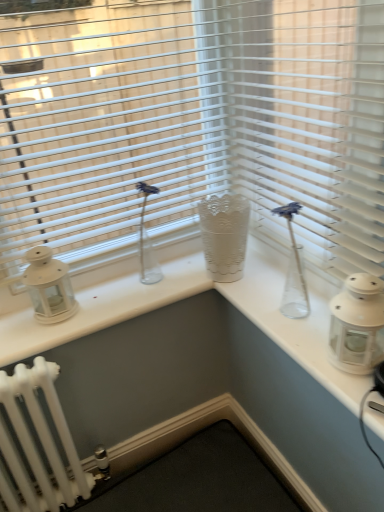
This screenshot has width=384, height=512. Describe the element at coordinates (299, 119) in the screenshot. I see `white plastic blinds at center` at that location.

Measure the distance between white glass lantern at right, which appears as the first candle holder when viewed from the right, and camera.

They are 31.14 inches apart.

The image size is (384, 512). I want to click on white plastic blinds at upper center, so click(x=193, y=126).

Between white plastic blinds at upper center and white glass lantern at right, the 2th candle holder viewed from the back, which one is positioned behind?

white plastic blinds at upper center is further from the camera.

Would you say white plastic blinds at upper center is outside white glass lantern at right, the 2th candle holder viewed from the back?

Yes, white plastic blinds at upper center is located beyond the bounds of white glass lantern at right, the 2th candle holder viewed from the back.

Relative to white plastic blinds at center, is white plastic blinds at upper center in front or behind?

white plastic blinds at upper center is behind white plastic blinds at center.

Is white plastic blinds at upper center aimed at white plastic blinds at center?

Yes.

Does white plastic blinds at upper center have a greater width compared to white plastic blinds at center?

Yes, white plastic blinds at upper center is wider than white plastic blinds at center.

Locate an element on the screen. The width and height of the screenshot is (384, 512). blind that appears in front of the white plastic blinds at upper center is located at coordinates (299, 119).

Is white plastic blinds at upper center surrounded by white glass lantern at right, which appears as the first candle holder when viewed from the right?

Definitely not — white plastic blinds at upper center is not inside white glass lantern at right, which appears as the first candle holder when viewed from the right.

Measure the distance between white glass lantern at right, which appears as the first candle holder when viewed from the right, and white plastic blinds at upper center.

white glass lantern at right, which appears as the first candle holder when viewed from the right, and white plastic blinds at upper center are 21.53 inches apart.

Visually, is white glass lantern at right, which appears as the first candle holder when viewed from the right, positioned to the left or to the right of white plastic blinds at upper center?

white glass lantern at right, which appears as the first candle holder when viewed from the right, is positioned on white plastic blinds at upper center's right side.

From a real-world perspective, is white glass lantern at right, the 2th candle holder in the left-to-right sequence, physically located above or below white plastic blinds at upper center?

white glass lantern at right, the 2th candle holder in the left-to-right sequence, is situated lower than white plastic blinds at upper center in the real world.

Looking at this image, can you confirm if white plastic blinds at center is bigger than white matte lantern at left, which is the first candle holder in back-to-front order?

Yes, white plastic blinds at center is bigger than white matte lantern at left, which is the first candle holder in back-to-front order.

From the image's perspective, is white plastic blinds at center positioned above or below white matte lantern at left, which is the second candle holder in right-to-left order?

Based on their image positions, white plastic blinds at center is located above white matte lantern at left, which is the second candle holder in right-to-left order.

Is white plastic blinds at center positioned far away from white matte lantern at left, positioned as the first candle holder in left-to-right order?

Actually, white plastic blinds at center and white matte lantern at left, positioned as the first candle holder in left-to-right order, are a little close together.

In the scene shown: Which point is more forward, (313, 103) or (49, 286)?

The point (313, 103) is closer to the camera.

Is white matte lantern at left, which is the second candle holder in right-to-left order, beside white plastic blinds at upper center?

Result: white matte lantern at left, which is the second candle holder in right-to-left order, and white plastic blinds at upper center are not in contact.

Identify the location of candle holder on the left of white plastic blinds at upper center. (49, 286).

Considering the sizes of objects white matte lantern at left, which is the second candle holder in right-to-left order, and white plastic blinds at upper center in the image provided, who is wider, white matte lantern at left, which is the second candle holder in right-to-left order, or white plastic blinds at upper center?

With larger width is white plastic blinds at upper center.

Can you confirm if white matte lantern at left, which is the first candle holder in back-to-front order, is bigger than white plastic blinds at upper center?

Actually, white matte lantern at left, which is the first candle holder in back-to-front order, might be smaller than white plastic blinds at upper center.

Which of these two, white glass lantern at right, the 2th candle holder viewed from the back, or white matte lantern at left, which is the second candle holder in right-to-left order, is wider?

With larger width is white glass lantern at right, the 2th candle holder viewed from the back.

Is there a large distance between white glass lantern at right, which appears as the first candle holder when viewed from the right, and white matte lantern at left, which is the first candle holder in back-to-front order?

No, there isn't a large distance between white glass lantern at right, which appears as the first candle holder when viewed from the right, and white matte lantern at left, which is the first candle holder in back-to-front order.

From a real-world perspective, is white glass lantern at right, the 2th candle holder in the left-to-right sequence, physically located above or below white matte lantern at left, placed as the 2th candle holder when sorted from front to back?

In terms of real-world spatial position, white glass lantern at right, the 2th candle holder in the left-to-right sequence, is above white matte lantern at left, placed as the 2th candle holder when sorted from front to back.

Is point (357, 287) closer or farther from the camera than point (66, 265)?

Point (357, 287).

Does white glass lantern at right, the 2th candle holder viewed from the back, appear on the left side of white plastic blinds at center?

Incorrect, white glass lantern at right, the 2th candle holder viewed from the back, is not on the left side of white plastic blinds at center.

Which point is more forward, (x=351, y=335) or (x=328, y=233)?

The point (x=351, y=335) is in front.

How far apart are white glass lantern at right, the 2th candle holder viewed from the back, and white plastic blinds at center?

white glass lantern at right, the 2th candle holder viewed from the back, is 41.08 centimeters away from white plastic blinds at center.

Considering the sizes of objects white glass lantern at right, the 2th candle holder in the left-to-right sequence, and white plastic blinds at center in the image provided, who is taller, white glass lantern at right, the 2th candle holder in the left-to-right sequence, or white plastic blinds at center?

white plastic blinds at center.

You are a GUI agent. You are given a task and a screenshot of the screen. Output one action in this format:
    pyautogui.click(x=<x>, y=<y>)
    Task: Click on the window blind above the white glass lantern at right, the 2th candle holder viewed from the back (from the image's perspective)
    Image resolution: width=384 pixels, height=512 pixels.
    Given the screenshot: What is the action you would take?
    pyautogui.click(x=193, y=126)

In the image, there is a white plastic blinds at upper center. Identify the location of blind below it (from the image's perspective). (299, 119).

Considering their positions, is white plastic blinds at center positioned closer to white plastic blinds at upper center than white glass lantern at right, the first candle holder from the front?

white plastic blinds at center is positioned closer to the anchor white plastic blinds at upper center.

Which object lies nearer to the anchor point white matte lantern at left, which is the first candle holder in back-to-front order, white glass lantern at right, the 2th candle holder viewed from the back, or white plastic blinds at center?

white plastic blinds at center lies closer to white matte lantern at left, which is the first candle holder in back-to-front order, than the other object.

From the image, which object appears to be nearer to white matte lantern at left, which is the second candle holder in right-to-left order, white glass lantern at right, the first candle holder from the front, or white plastic blinds at upper center?

The object closer to white matte lantern at left, which is the second candle holder in right-to-left order, is white plastic blinds at upper center.

From the image, which object appears to be farther from white glass lantern at right, the first candle holder from the front, white plastic blinds at center or white plastic blinds at upper center?

white plastic blinds at upper center.

Estimate the real-world distances between objects in this image. Which object is further from white plastic blinds at center, white glass lantern at right, which appears as the first candle holder when viewed from the right, or white plastic blinds at upper center?

white glass lantern at right, which appears as the first candle holder when viewed from the right, is further to white plastic blinds at center.

Based on their spatial positions, is white matte lantern at left, which is the first candle holder in back-to-front order, or white plastic blinds at center closer to white glass lantern at right, the first candle holder from the front?

Based on the image, white plastic blinds at center appears to be nearer to white glass lantern at right, the first candle holder from the front.

Which object lies further to the anchor point white matte lantern at left, positioned as the first candle holder in left-to-right order, white plastic blinds at upper center or white glass lantern at right, the first candle holder from the front?

Based on the image, white glass lantern at right, the first candle holder from the front, appears to be further to white matte lantern at left, positioned as the first candle holder in left-to-right order.

Based on their spatial positions, is white plastic blinds at upper center or white glass lantern at right, the 2th candle holder in the left-to-right sequence, closer to white plastic blinds at center?

Based on the image, white plastic blinds at upper center appears to be nearer to white plastic blinds at center.

Find the location of a particular element. window blind between white matte lantern at left, which is the second candle holder in right-to-left order, and white glass lantern at right, the 2th candle holder viewed from the back, in the horizontal direction is located at coordinates (193, 126).

You are a GUI agent. You are given a task and a screenshot of the screen. Output one action in this format:
    pyautogui.click(x=<x>, y=<y>)
    Task: Click on the blind situated between white matte lantern at left, placed as the 2th candle holder when sorted from front to back, and white glass lantern at right, the first candle holder from the front, from left to right
    Image resolution: width=384 pixels, height=512 pixels.
    Given the screenshot: What is the action you would take?
    pyautogui.click(x=299, y=119)

Find the location of `blind between white plastic blinds at upper center and white glass lantern at right, the 2th candle holder in the left-to-right sequence`. blind between white plastic blinds at upper center and white glass lantern at right, the 2th candle holder in the left-to-right sequence is located at coordinates (299, 119).

Find the location of `window blind between white matte lantern at left, which is the second candle holder in right-to-left order, and white plastic blinds at center`. window blind between white matte lantern at left, which is the second candle holder in right-to-left order, and white plastic blinds at center is located at coordinates (193, 126).